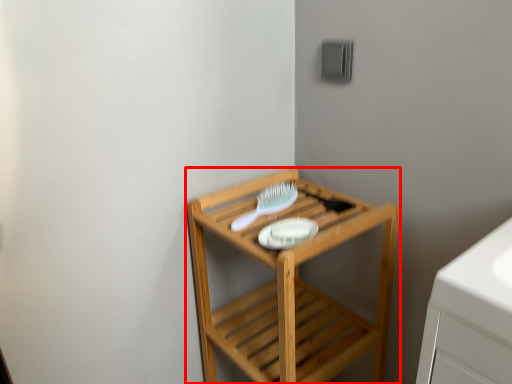
Question: From the image's perspective, considering the relative positions of furniture (annotated by the red box) and brush in the image provided, where is furniture (annotated by the red box) located with respect to the staircase?

Choices:
 (A) below
 (B) above

Answer: (A)